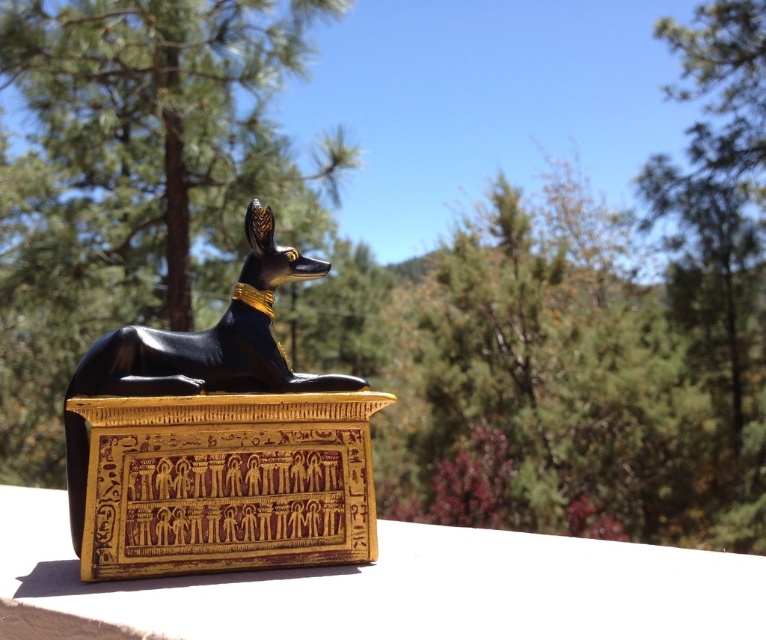
Which of these two, black glossy statue at center or matte gold box at center, stands shorter?

matte gold box at center

Can you confirm if black glossy statue at center is positioned above matte gold box at center?

Correct, black glossy statue at center is located above matte gold box at center.

Between point (119, 550) and point (167, 625), which one is positioned in front?

Positioned in front is point (167, 625).

Locate an element on the screen. Image resolution: width=766 pixels, height=640 pixels. black glossy statue at center is located at coordinates (218, 442).